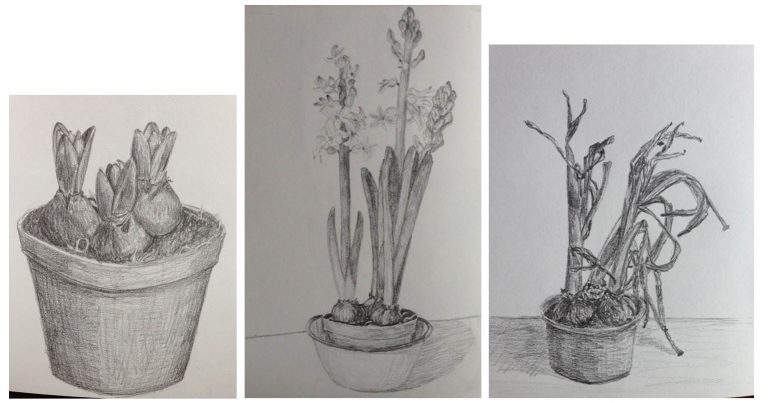
This screenshot has height=403, width=768. Find the location of `bowl`. bowl is located at coordinates (361, 375).